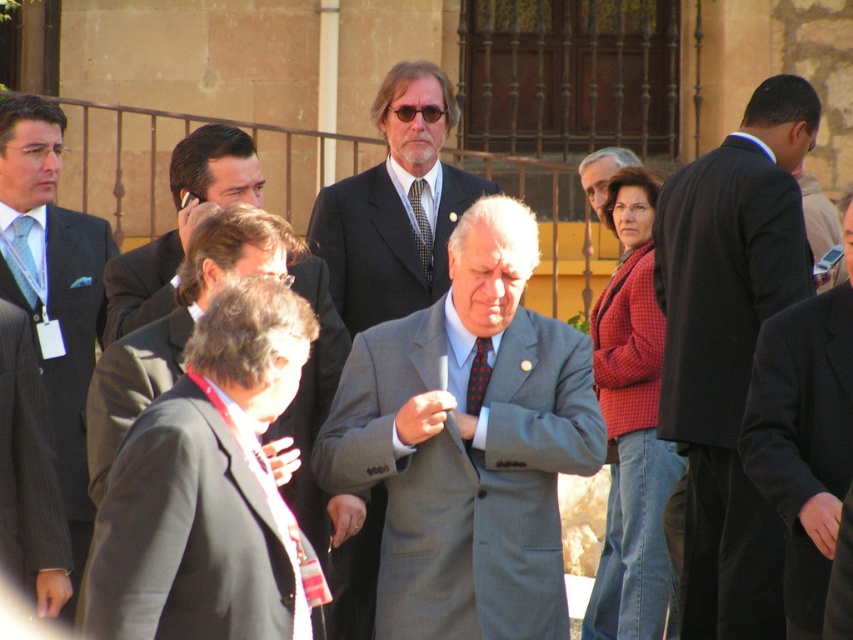
From the picture: Is gray suit at center below patterned silk tie at center?

Yes.

Can you confirm if gray suit at center is wider than patterned silk tie at center?

Correct, the width of gray suit at center exceeds that of patterned silk tie at center.

The image size is (853, 640). I want to click on gray suit at center, so click(468, 444).

Where is `gray suit at center`? gray suit at center is located at coordinates (468, 444).

Is matte blue tie at left to the right of patterned silk tie at center from the viewer's perspective?

In fact, matte blue tie at left is to the left of patterned silk tie at center.

Is matte blue tie at left closer to the viewer compared to patterned silk tie at center?

Yes, it is in front of patterned silk tie at center.

Locate an element on the screen. matte blue tie at left is located at coordinates (25, 259).

Find the location of `matte blue tie at left`. matte blue tie at left is located at coordinates (25, 259).

Is dark gray suit at center smaller than patterned silk tie at center?

No, dark gray suit at center is not smaller than patterned silk tie at center.

Based on the photo, between dark gray suit at center and patterned silk tie at center, which one has more height?

With more height is dark gray suit at center.

Which is in front, point (735, 301) or point (415, 186)?

Point (735, 301)

In order to click on dark gray suit at center in this screenshot , I will do `click(729, 348)`.